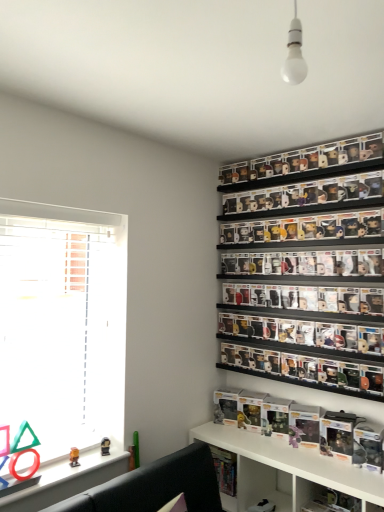
Question: Can you confirm if white glossy shelf at lower center, the first shelf positioned from the bottom, is positioned to the right of white glossy bulb at upper center?

Choices:
 (A) yes
 (B) no

Answer: (A)

Question: Are white glossy shelf at lower center, the first shelf positioned from the bottom, and white glossy bulb at upper center far apart?

Choices:
 (A) no
 (B) yes

Answer: (B)

Question: Does white glossy shelf at lower center, marked as the 4th shelf in a top-to-bottom arrangement, have a smaller size compared to white glossy bulb at upper center?

Choices:
 (A) no
 (B) yes

Answer: (A)

Question: Is white glossy shelf at lower center, marked as the 4th shelf in a top-to-bottom arrangement, oriented away from white glossy bulb at upper center?

Choices:
 (A) no
 (B) yes

Answer: (A)

Question: Considering the relative sizes of white glossy shelf at lower center, marked as the 4th shelf in a top-to-bottom arrangement, and white glossy bulb at upper center in the image provided, is white glossy shelf at lower center, marked as the 4th shelf in a top-to-bottom arrangement, bigger than white glossy bulb at upper center?

Choices:
 (A) no
 (B) yes

Answer: (B)

Question: Does white glossy shelf at lower center, the first shelf positioned from the bottom, have a lesser height compared to white glossy bulb at upper center?

Choices:
 (A) no
 (B) yes

Answer: (A)

Question: From the image's perspective, is white matte window at left on white glossy bulb at upper center?

Choices:
 (A) yes
 (B) no

Answer: (B)

Question: Can you confirm if white matte window at left is bigger than white glossy bulb at upper center?

Choices:
 (A) yes
 (B) no

Answer: (A)

Question: Can you confirm if white matte window at left is positioned to the right of white glossy bulb at upper center?

Choices:
 (A) no
 (B) yes

Answer: (A)

Question: Can you confirm if white matte window at left is thinner than white glossy bulb at upper center?

Choices:
 (A) no
 (B) yes

Answer: (A)

Question: Is white matte window at left positioned with its back to white glossy bulb at upper center?

Choices:
 (A) no
 (B) yes

Answer: (A)

Question: From a real-world perspective, is white matte window at left located higher than white glossy bulb at upper center?

Choices:
 (A) yes
 (B) no

Answer: (B)

Question: Is clear plastic figures at upper right, placed as the first shelf when sorted from top to bottom, smaller than white glossy shelf at lower center, the first shelf positioned from the bottom?

Choices:
 (A) yes
 (B) no

Answer: (A)